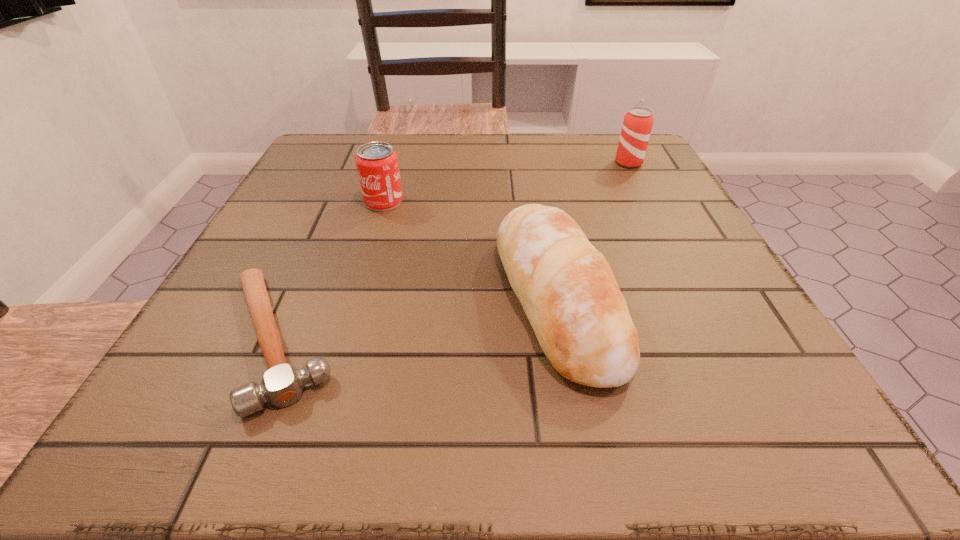
Find the location of `free space at the far left corner of the desktop`. free space at the far left corner of the desktop is located at coordinates (311, 173).

Where is `vacant area at the near left corner`? The image size is (960, 540). vacant area at the near left corner is located at coordinates (169, 394).

Find the location of `vacant region at the far right corner`. vacant region at the far right corner is located at coordinates (624, 176).

Find the location of `blank area at the near right corner`. blank area at the near right corner is located at coordinates (765, 436).

Locate an element on the screen. empty space that is in between the second object from right to left and the can is located at coordinates (469, 250).

Locate an element on the screen. The image size is (960, 540). vacant area that lies between the rightmost object and the hammer is located at coordinates (453, 251).

Where is `free space between the shortest object and the second object from right to left`? The width and height of the screenshot is (960, 540). free space between the shortest object and the second object from right to left is located at coordinates (417, 319).

Locate an element on the screen. The height and width of the screenshot is (540, 960). free space between the second object from right to left and the third nearest object is located at coordinates (469, 250).

Find the location of a particular element. This screenshot has height=540, width=960. free space between the beer can and the can is located at coordinates (506, 183).

The image size is (960, 540). I want to click on vacant region between the shortest object and the can, so click(x=330, y=270).